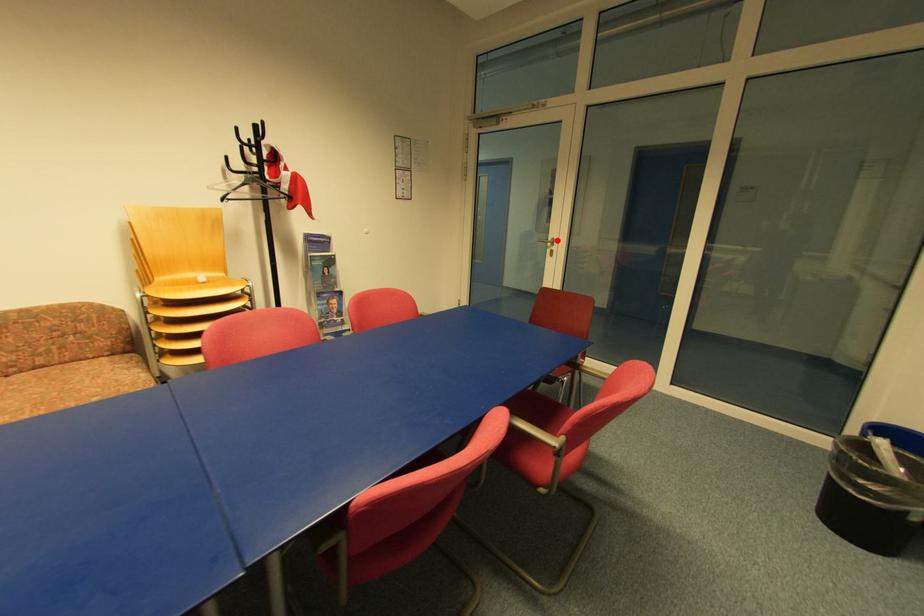
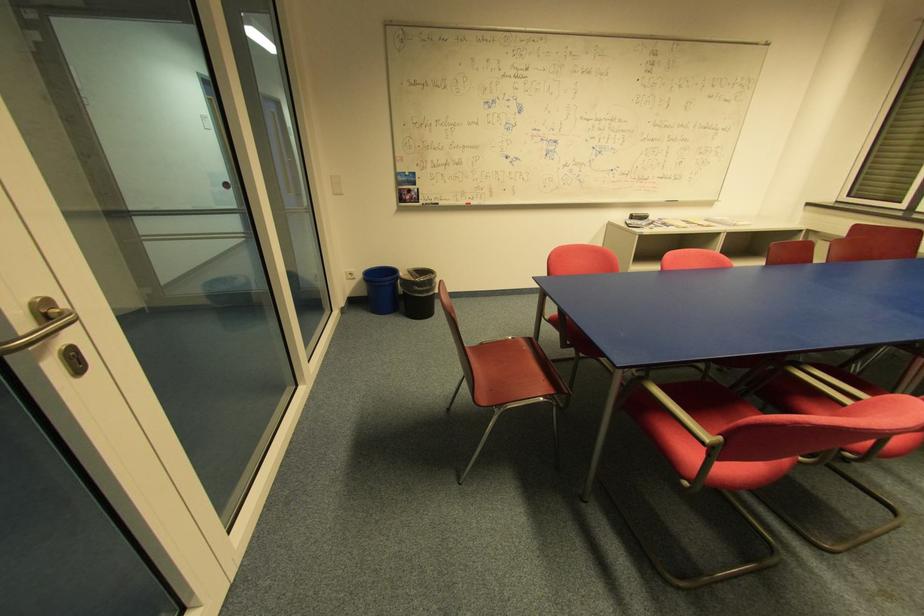
Locate, in the second image, the point that corresponds to the highlighted location in the first image.

(51, 304)